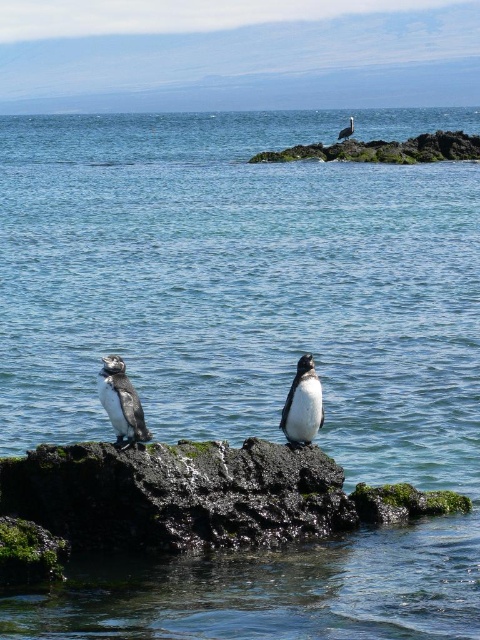
Who is higher up, rough rock at upper right or white fluffy penguin at upper right?

white fluffy penguin at upper right is above.

Is point (469, 141) farther from camera compared to point (348, 131)?

No, it is not.

Does point (456, 144) come in front of point (345, 134)?

Yes.

Identify the location of rough rock at upper right. (384, 148).

Can you confirm if black glossy penguin at center is positioned to the left of white fluffy penguin at upper right?

Correct, you'll find black glossy penguin at center to the left of white fluffy penguin at upper right.

In order to click on black glossy penguin at center in this screenshot , I will do `click(302, 404)`.

Which is behind, point (313, 154) or point (320, 401)?

Point (313, 154)

Does rough rock at upper right have a larger size compared to black glossy penguin at center?

Correct, rough rock at upper right is larger in size than black glossy penguin at center.

Image resolution: width=480 pixels, height=640 pixels. Find the location of `rough rock at upper right`. rough rock at upper right is located at coordinates (384, 148).